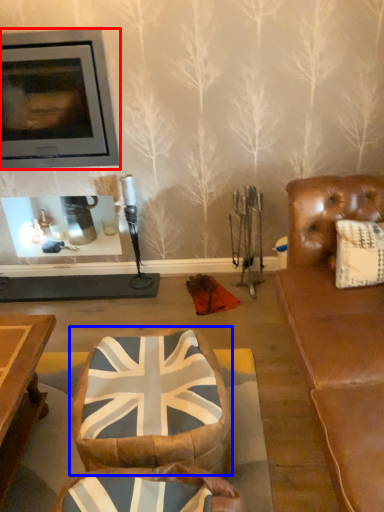
Question: Which of the following is the farthest to the observer, fireplace (highlighted by a red box) or bean bag chair (highlighted by a blue box)?

Choices:
 (A) fireplace
 (B) bean bag chair

Answer: (A)